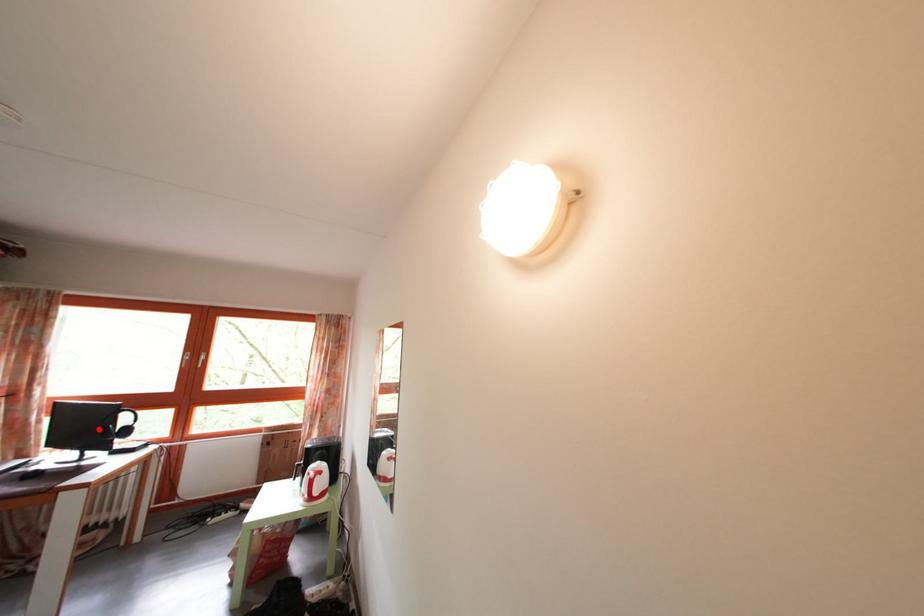
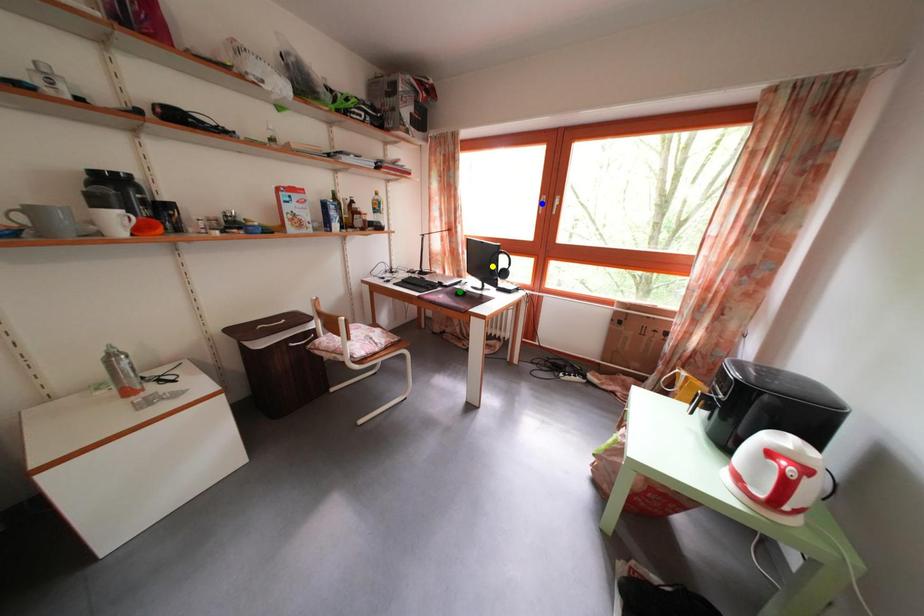
Question: I am providing you with two images of the same scene from different viewpoints. A red point is marked on the first image. You are given multiple points on the second image. Which mark in image 2 goes with the point in image 1?

Choices:
 (A) yellow point
 (B) green point
 (C) blue point

Answer: (A)